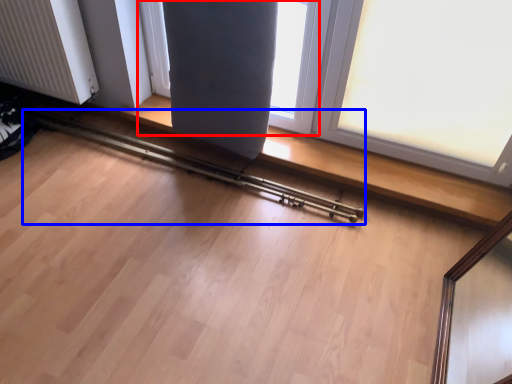
Question: Which point is closer to the camera, window (highlighted by a red box) or rail (highlighted by a blue box)?

Choices:
 (A) window
 (B) rail

Answer: (A)